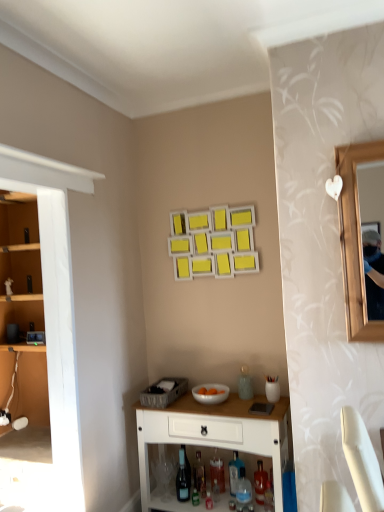
Question: From the image's perspective, is translucent glass bottle at lower center, placed as the 6th bottle when sorted from right to left, positioned above or below translucent glass wine bottle at lower center?

Choices:
 (A) below
 (B) above

Answer: (A)

Question: From their relative heights in the image, would you say translucent glass bottle at lower center, the first bottle viewed from the left, is taller or shorter than translucent glass wine bottle at lower center?

Choices:
 (A) tall
 (B) short

Answer: (B)

Question: Which is farther from the white glossy cabinet at lower center?

Choices:
 (A) white glossy bowl at lower center
 (B) translucent glass bottle at lower center, the 4th bottle in the left-to-right sequence
 (C) translucent glass wine bottle at lower center
 (D) translucent glass bottle at lower center, which appears as the 1th bottle when viewed from the right
 (E) translucent glass bottle at center, which ranks as the fifth bottle in right-to-left order

Answer: (B)

Question: Which is farther from the translucent glass wine bottle at lower center?

Choices:
 (A) translucent glass bottle at lower center, the 4th bottle in the left-to-right sequence
 (B) translucent glass bottle at lower center, the first bottle viewed from the left
 (C) translucent plastic bottle at lower center, positioned as the 2th bottle in right-to-left order
 (D) translucent glass bottle at center, the third bottle when ordered from left to right
 (E) translucent glass bottle at lower center, which is counted as the 6th bottle, starting from the left

Answer: (E)